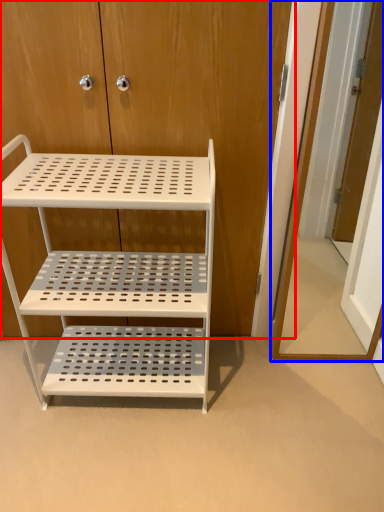
Question: Which object is further to the camera taking this photo, dresser (highlighted by a red box) or door (highlighted by a blue box)?

Choices:
 (A) dresser
 (B) door

Answer: (A)